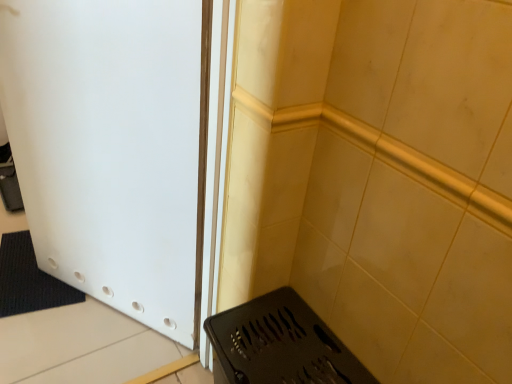
The height and width of the screenshot is (384, 512). What do you see at coordinates (279, 345) in the screenshot?
I see `black matte grill at lower right` at bounding box center [279, 345].

The image size is (512, 384). I want to click on black matte grill at lower right, so click(279, 345).

The height and width of the screenshot is (384, 512). Describe the element at coordinates (113, 147) in the screenshot. I see `white matte door at left` at that location.

What is the approximate height of white matte door at left?

white matte door at left is 4.05 feet tall.

What are the coordinates of `white matte door at left` in the screenshot? It's located at (113, 147).

You are a GUI agent. You are given a task and a screenshot of the screen. Output one action in this format:
    pyautogui.click(x=<x>, y=<y>)
    Task: Click on the black matte grill at lower right
    This screenshot has width=512, height=384.
    Given the screenshot: What is the action you would take?
    pyautogui.click(x=279, y=345)

Is white matte door at left to the left of black matte grill at lower right from the viewer's perspective?

Correct, you'll find white matte door at left to the left of black matte grill at lower right.

Who is more distant, white matte door at left or black matte grill at lower right?

black matte grill at lower right is behind.

Considering the positions of point (181, 324) and point (249, 361), is point (181, 324) closer or farther from the camera than point (249, 361)?

Point (181, 324).

From the image's perspective, does white matte door at left appear higher than black matte grill at lower right?

Yes, from the image's perspective, white matte door at left is above black matte grill at lower right.

From a real-world perspective, between white matte door at left and black matte grill at lower right, who is vertically higher?

white matte door at left.

Looking at their sizes, would you say white matte door at left is wider or thinner than black matte grill at lower right?

Considering their sizes, white matte door at left looks slimmer than black matte grill at lower right.

Which of these two, white matte door at left or black matte grill at lower right, stands shorter?

With less height is black matte grill at lower right.

Does white matte door at left have a smaller size compared to black matte grill at lower right?

No, white matte door at left is not smaller than black matte grill at lower right.

Is white matte door at left not within black matte grill at lower right?

Yes, white matte door at left is outside of black matte grill at lower right.

Looking at this image, is white matte door at left with black matte grill at lower right?

No, white matte door at left is not making contact with black matte grill at lower right.

Consider the image. Is white matte door at left looking in the opposite direction of black matte grill at lower right?

No, white matte door at left's orientation is not away from black matte grill at lower right.

Find the location of a particular element. The width and height of the screenshot is (512, 384). door located above the black matte grill at lower right (from the image's perspective) is located at coordinates (113, 147).

Which is more to the right, black matte grill at lower right or white matte door at left?

Positioned to the right is black matte grill at lower right.

Is black matte grill at lower right positioned in front of white matte door at left?

No, the depth of black matte grill at lower right is greater than that of white matte door at left.

Which is nearer, (349, 376) or (97, 217)?

The point (349, 376) is in front.

From the image's perspective, does black matte grill at lower right appear lower than white matte door at left?

Indeed, from the image's perspective, black matte grill at lower right is shown beneath white matte door at left.

From a real-world perspective, is black matte grill at lower right on top of white matte door at left?

Incorrect, from a real-world perspective, black matte grill at lower right is lower than white matte door at left.

Which object is wider, black matte grill at lower right or white matte door at left?

With larger width is black matte grill at lower right.

Between black matte grill at lower right and white matte door at left, which one has less height?

Standing shorter between the two is black matte grill at lower right.

Is black matte grill at lower right bigger or smaller than white matte door at left?

black matte grill at lower right is smaller than white matte door at left.

Is white matte door at left a part of black matte grill at lower right?

Definitely not — white matte door at left is not inside black matte grill at lower right.

Does black matte grill at lower right touch white matte door at left?

No, black matte grill at lower right is not with white matte door at left.

From the picture: Could you tell me if black matte grill at lower right is turned towards white matte door at left?

No, black matte grill at lower right does not turn towards white matte door at left.

Measure the distance from black matte grill at lower right to white matte door at left.

black matte grill at lower right and white matte door at left are 56.79 centimeters apart from each other.

You are a GUI agent. You are given a task and a screenshot of the screen. Output one action in this format:
    pyautogui.click(x=<x>, y=<y>)
    Task: Click on the door to the left of black matte grill at lower right
    This screenshot has height=384, width=512.
    Given the screenshot: What is the action you would take?
    click(113, 147)

In order to click on door above the black matte grill at lower right (from a real-world perspective) in this screenshot , I will do `click(113, 147)`.

The height and width of the screenshot is (384, 512). I want to click on appliance behind the white matte door at left, so click(279, 345).